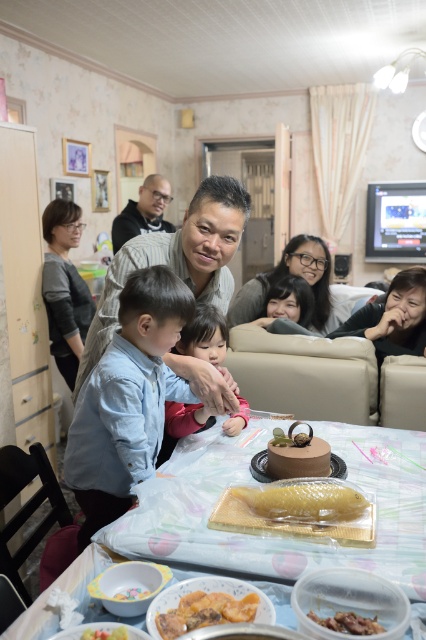
You are standing in the living room and see two points on the table covered with a light blue tablecloth. The first point is at coordinates point (2, 636) and the second is at point (207, 324). Which point is closer to you?

Point (2, 636) is in front of point (207, 324), so it is closer to you.

You are a guest at the celebration and want to place a small candle on the table without blocking the cake. Considering the golden glazed fish at center and the white glossy bowl at lower left, which object should you place the candle next to to ensure it is visible?

The golden glazed fish at center is taller than the white glossy bowl at lower left, so placing the candle next to the white glossy bowl at lower left would ensure it remains visible without being blocked by the taller fish.

You are a guest at the celebration and want to reach the golden glazed fish at center to admire it. However, there is a gray sweater at left in the way. From your perspective standing at the table, which object is closer to you?

The gray sweater at left is located above the golden glazed fish at center, so the gray sweater at left is closer to you.